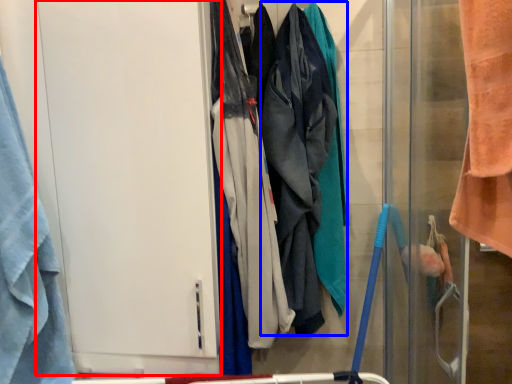
Question: Which object is closer to the camera taking this photo, screen door (highlighted by a red box) or wide (highlighted by a blue box)?

Choices:
 (A) screen door
 (B) wide

Answer: (A)